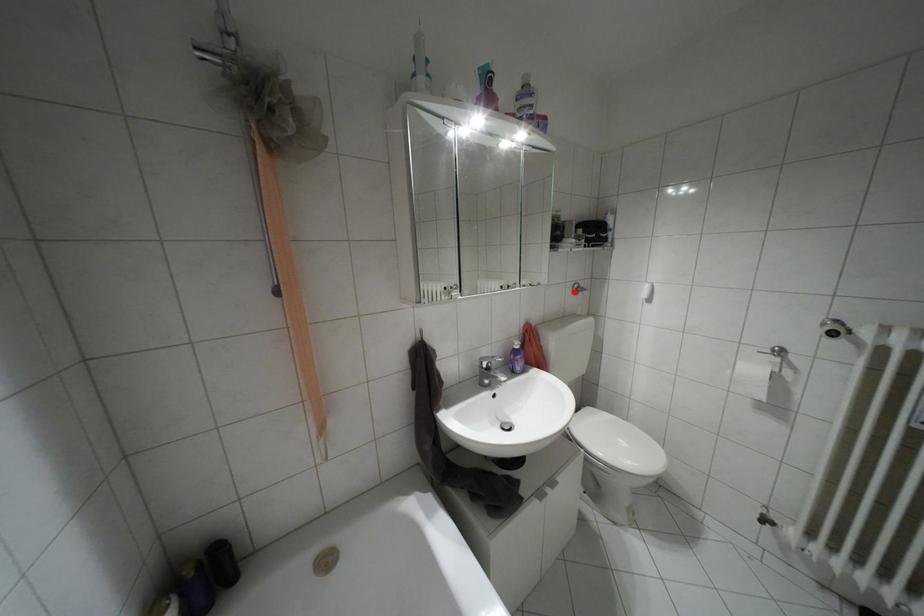
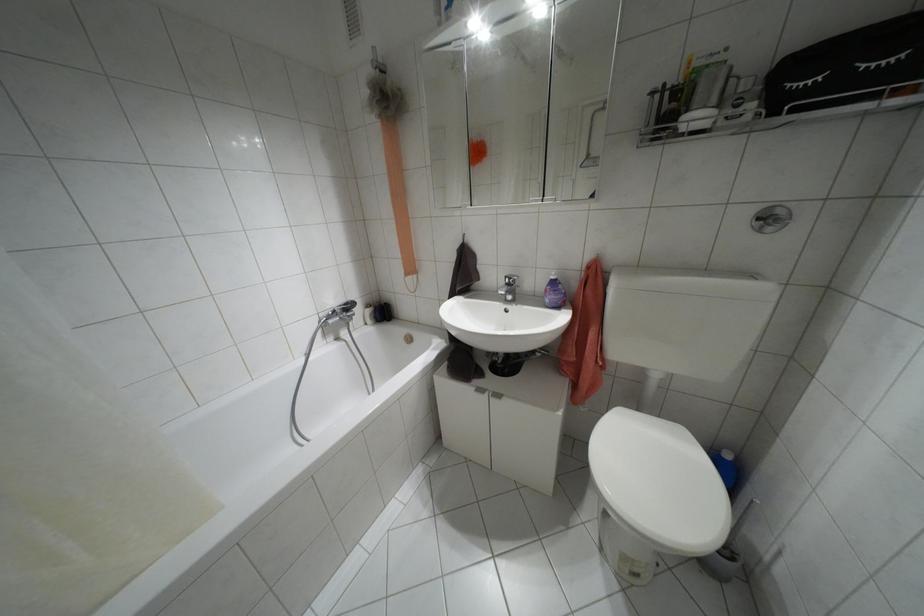
Locate, in the second image, the point that corresponds to the highlighted location in the first image.

(769, 228)